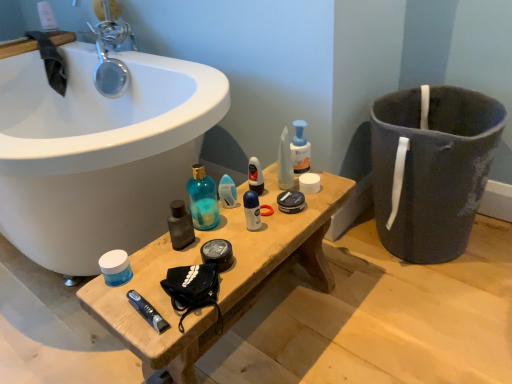
Where is `empty space that is in between wooden bench at center and dark gray fabric trash bin/can at right`? This screenshot has width=512, height=384. empty space that is in between wooden bench at center and dark gray fabric trash bin/can at right is located at coordinates (359, 306).